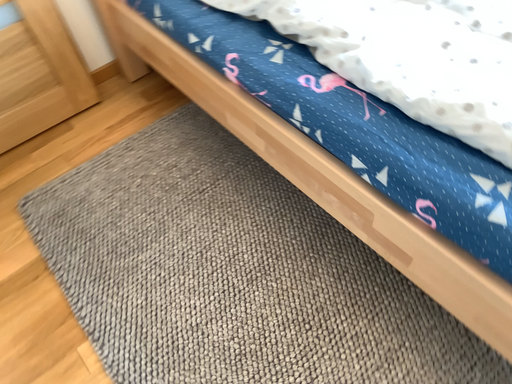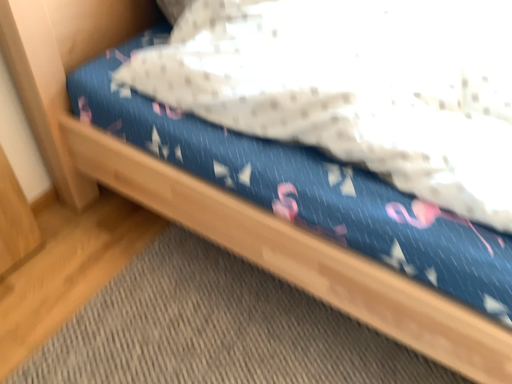
Question: Which way did the camera rotate in the video?

Choices:
 (A) rotated downward
 (B) rotated upward

Answer: (B)